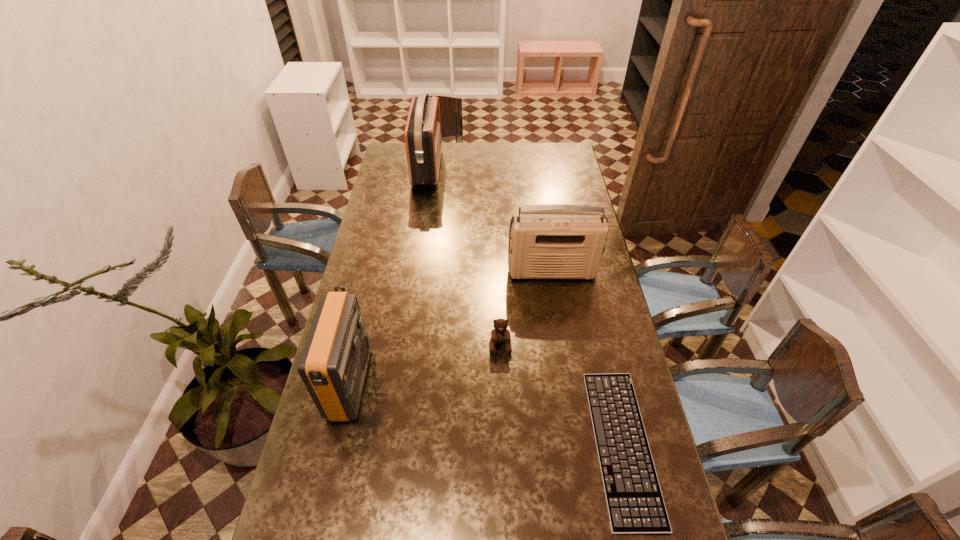
At what (x,y) coordinates should I click in order to perform the action: click on free point located on the front-facing side of the second farthest radio receiver. Please return your answer as a coordinate pair (x, y). The image size is (960, 540). Looking at the image, I should click on (564, 348).

This screenshot has width=960, height=540. Identify the location of vacant space situated 0.340m on the front-facing side of the leftmost radio receiver. (481, 384).

Find the location of a particular element. free location located on the face of the teddy bear is located at coordinates (503, 417).

The image size is (960, 540). I want to click on vacant region located on the back of the shortest object, so (591, 312).

You are a GUI agent. You are given a task and a screenshot of the screen. Output one action in this format:
    pyautogui.click(x=<x>, y=<y>)
    Task: Click on the object that is at the far edge
    Image resolution: width=960 pixels, height=540 pixels.
    Given the screenshot: What is the action you would take?
    pyautogui.click(x=423, y=141)

Where is `radio receiver located at the right edge`? This screenshot has height=540, width=960. radio receiver located at the right edge is located at coordinates (550, 241).

I want to click on computer keyboard at the right edge, so click(635, 504).

Locate an element on the screen. object that is at the far left corner is located at coordinates (423, 141).

At what (x,y) coordinates should I click in order to perform the action: click on blank space at the far edge of the desktop. Please return your answer as a coordinate pair (x, y). Looking at the image, I should click on (487, 163).

Where is `vacant space at the left edge of the desktop`? vacant space at the left edge of the desktop is located at coordinates [402, 260].